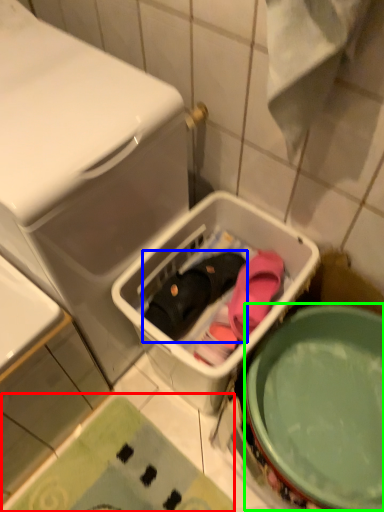
Question: Estimate the real-world distances between objects in this image. Which object is closer to bath mat (highlighted by a red box), footwear (highlighted by a blue box) or mixing bowl (highlighted by a green box)?

Choices:
 (A) footwear
 (B) mixing bowl

Answer: (B)